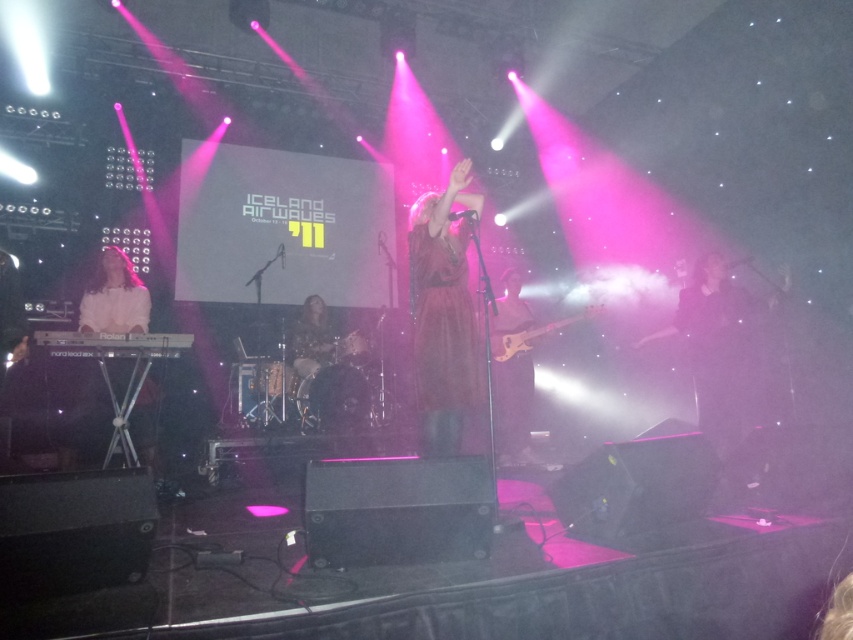
Is point (125, 298) less distant than point (329, 349)?

Yes.

Does white matte keyboard at left have a larger size compared to floral-patterned dress at center?

No.

You are a GUI agent. You are given a task and a screenshot of the screen. Output one action in this format:
    pyautogui.click(x=<x>, y=<y>)
    Task: Click on the white matte keyboard at left
    
    Given the screenshot: What is the action you would take?
    pyautogui.click(x=114, y=298)

Who is lower down, matte brown guitar at center or floral-patterned dress at center?

matte brown guitar at center is lower down.

Who is positioned more to the left, matte brown guitar at center or floral-patterned dress at center?

Positioned to the left is floral-patterned dress at center.

Is point (509, 426) positioned after point (329, 340)?

No, (509, 426) is closer to viewer.

What are the coordinates of `matte brown guitar at center` in the screenshot? It's located at (514, 406).

Is black fabric at center taller than matte pink dress at center?

Incorrect, black fabric at center's height is not larger of matte pink dress at center's.

What do you see at coordinates (729, 364) in the screenshot?
I see `black fabric at center` at bounding box center [729, 364].

In order to click on black fabric at center in this screenshot , I will do tap(729, 364).